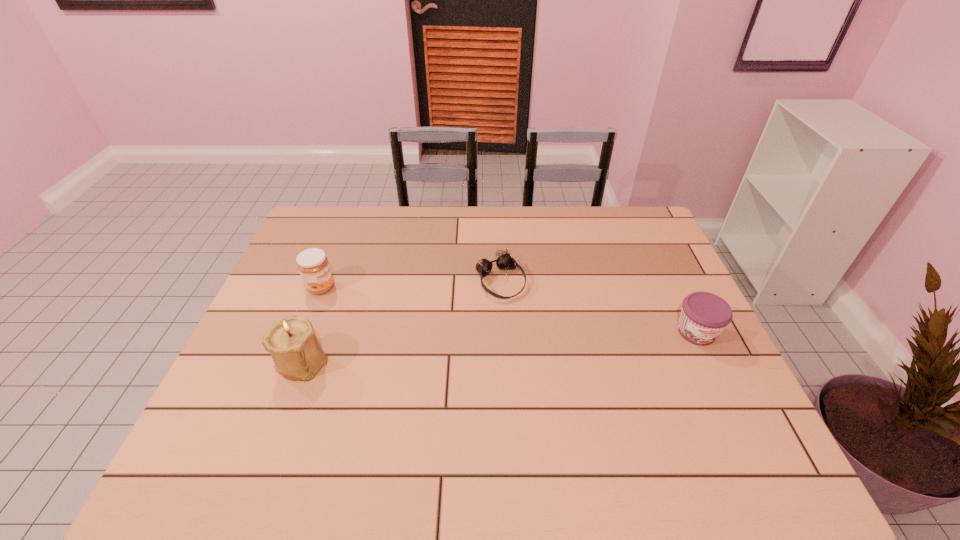
Find the location of a particular element. vacant space that's between the third shortest object and the goggles is located at coordinates (411, 284).

Find the location of `vacant space that is in between the shorter jam and the tallest object`. vacant space that is in between the shorter jam and the tallest object is located at coordinates (x=499, y=346).

I want to click on object that is the third nearest to the shorter jam, so click(313, 265).

Where is `object that is the second closest to the farther jam`? object that is the second closest to the farther jam is located at coordinates (504, 261).